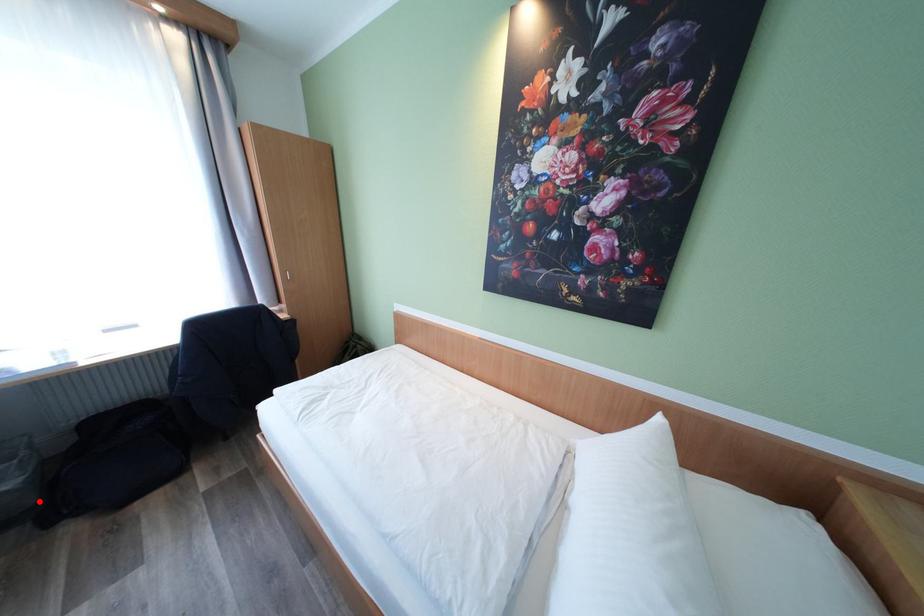
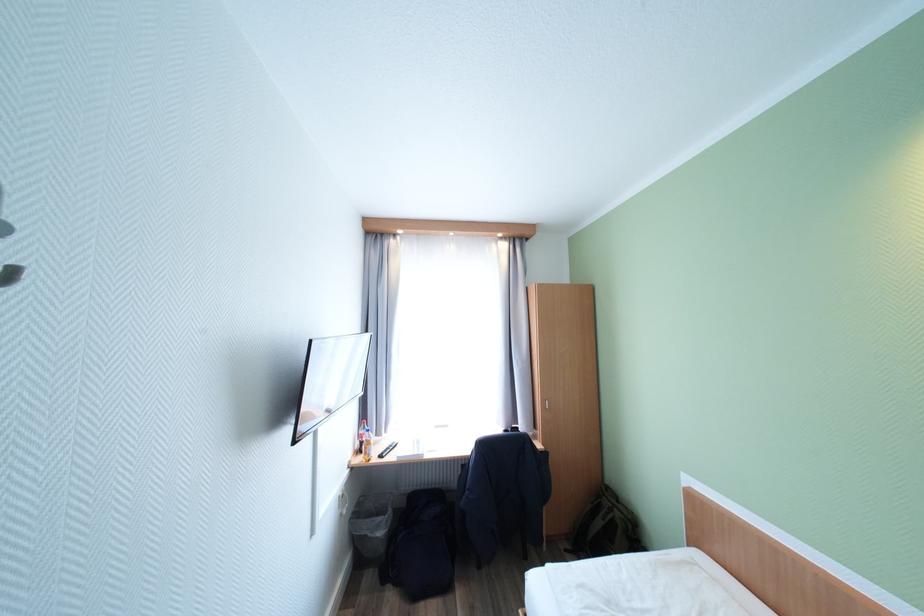
Question: I am providing you with two images of the same scene from different viewpoints. A red point is shown in image1. For the corresponding object point in image2, is it positioned nearer or farther from the camera?

Choices:
 (A) Nearer
 (B) Farther

Answer: (B)